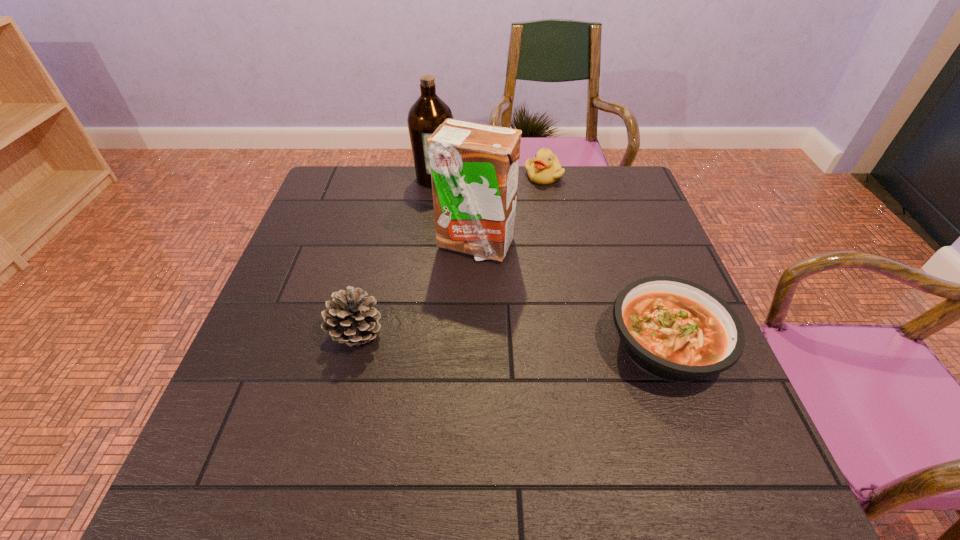
Where is `free space on the desktop that is between the pinecone and the rightmost object and is positioned on the label of the olive oil`? This screenshot has width=960, height=540. free space on the desktop that is between the pinecone and the rightmost object and is positioned on the label of the olive oil is located at coordinates (552, 341).

The height and width of the screenshot is (540, 960). Identify the location of vacant space on the desktop that is between the third tallest object and the stew and is positioned on the straw side of the third farthest object. (534, 341).

Find the location of a particular element. vacant space on the desktop that is between the pinecone and the rightmost object and is positioned on the front-facing side of the second object from right to left is located at coordinates (524, 340).